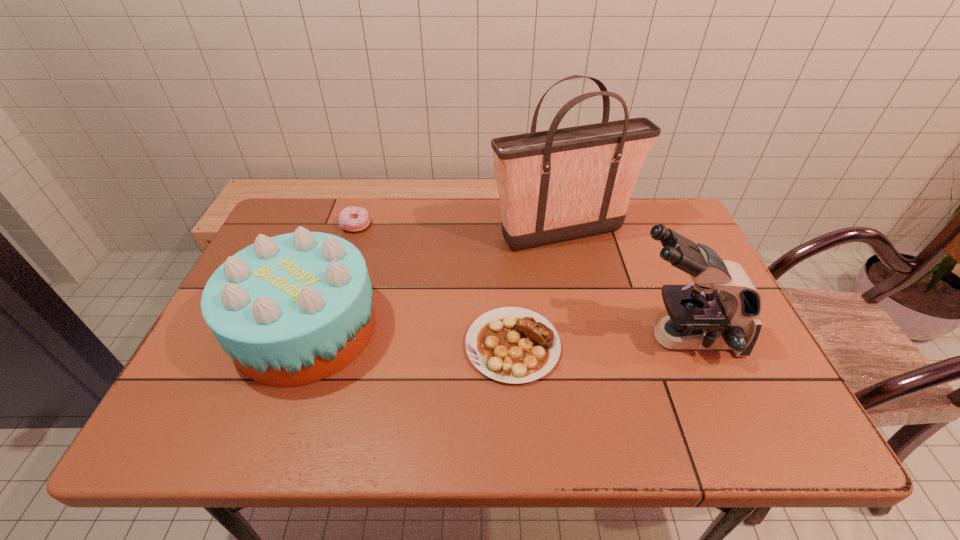
You are a GUI agent. You are given a task and a screenshot of the screen. Output one action in this format:
    pyautogui.click(x=<x>, y=<y>)
    Task: Click on the vacant space that's between the steak and the doughnut
    
    Given the screenshot: What is the action you would take?
    pyautogui.click(x=434, y=285)

Find the location of a particular element. This screenshot has height=540, width=960. free space that is in between the third tallest object and the steak is located at coordinates (410, 337).

Where is `empty location between the shopping bag and the steak`? empty location between the shopping bag and the steak is located at coordinates 538,289.

Locate an element on the screen. The image size is (960, 540). free space between the tallest object and the third shortest object is located at coordinates (434, 281).

Where is `free space that is in between the fourth shortest object and the shopping bag`? Image resolution: width=960 pixels, height=540 pixels. free space that is in between the fourth shortest object and the shopping bag is located at coordinates (622, 286).

The width and height of the screenshot is (960, 540). I want to click on vacant area between the cake and the steak, so click(410, 337).

Identify which object is located as the third nearest to the third tallest object. Please provide its 2D coordinates. Your answer should be formatted as a tuple, i.e. [(x, y)], where the tuple contains the x and y coordinates of a point satisfying the conditions above.

[(557, 185)]

Find the location of `the second closest object to the cake`. the second closest object to the cake is located at coordinates (514, 345).

Where is `vacant space that satisfies the following two spatial constraints: 1. on the back side of the shopping bag; 2. on the right side of the steak`? The height and width of the screenshot is (540, 960). vacant space that satisfies the following two spatial constraints: 1. on the back side of the shopping bag; 2. on the right side of the steak is located at coordinates (505, 234).

Find the location of a particular element. Image resolution: width=960 pixels, height=540 pixels. free region that satisfies the following two spatial constraints: 1. on the back side of the third shortest object; 2. on the right side of the shopping bag is located at coordinates (341, 234).